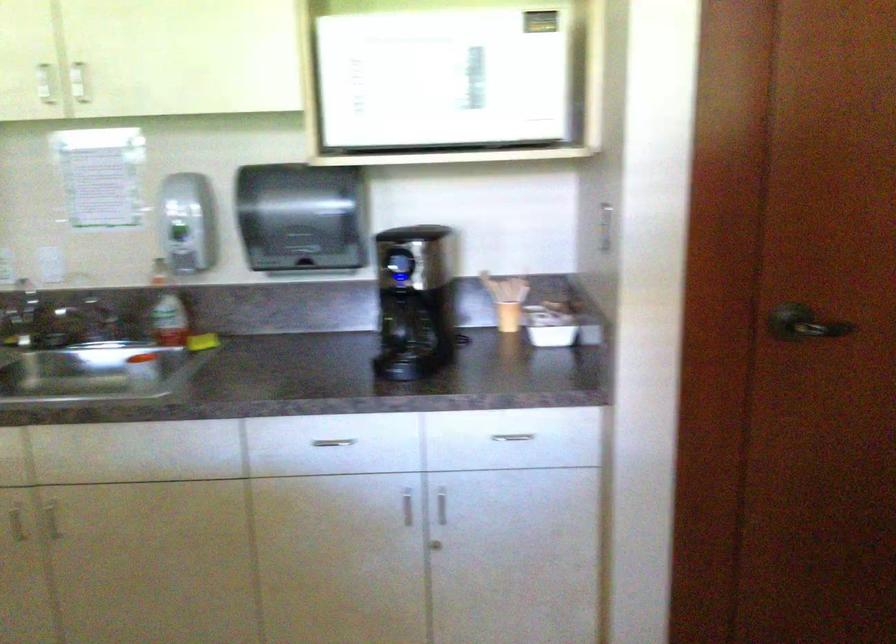
What do you see at coordinates (803, 323) in the screenshot? The width and height of the screenshot is (896, 644). I see `the dark door handle` at bounding box center [803, 323].